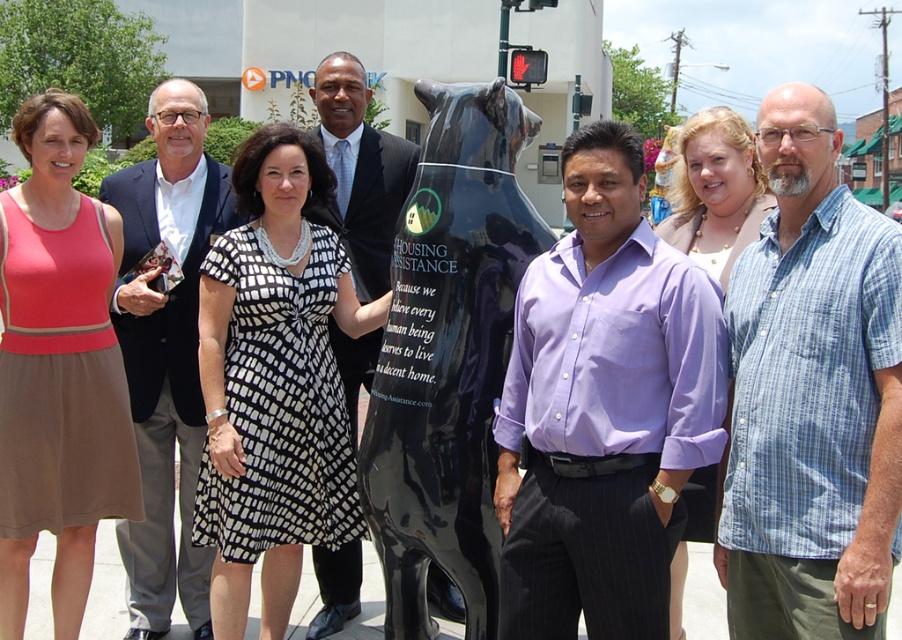
You are a photographer adjusting the camera height to ensure both the blue plaid shirt at center and the shiny black suit at center are fully visible in the frame. Based on their heights, which one requires the camera to be positioned lower to avoid cropping the top of the clothing?

The blue plaid shirt at center is shorter than the shiny black suit at center, so the camera should be positioned lower to ensure the top of the blue plaid shirt at center is visible without cropping, while also accommodating the taller shiny black suit at center.

You are a photographer taking a picture of the group and the sculpture. You want to ensure that the purple cotton shirt at center is visible above the black glossy bear at center in the final image. Based on their current positions, is this possible? Explain your reasoning.

The purple cotton shirt at center is positioned under the black glossy bear at center, so it is currently below and likely obscured by the bear. To make the shirt visible above the bear, the photographer would need to adjust the composition, such as moving the shirt wearer upward or repositioning the bear sculpture, but since the bear is a large fixed sculpture, the only option is to have the shirt wearer move higher in the frame or adjust the camera angle to capture the shirt above the bear in the shot.

You are a photographer adjusting the lighting for a group photo. You notice the blue plaid shirt at center and the black glossy bear at center. Which object is closer to the camera?

The blue plaid shirt at center is positioned over the black glossy bear at center, meaning it is closer to the camera.